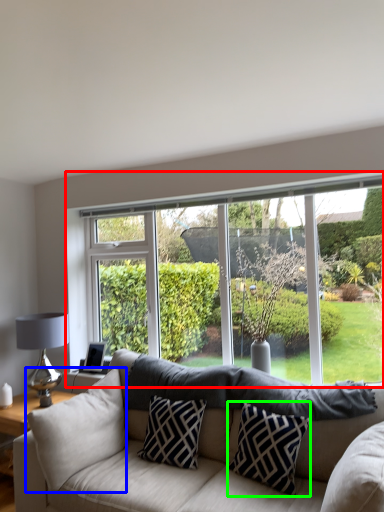
Question: Which is nearer to the window (highlighted by a red box)? pillow (highlighted by a blue box) or pillow (highlighted by a green box).

Choices:
 (A) pillow
 (B) pillow

Answer: (B)